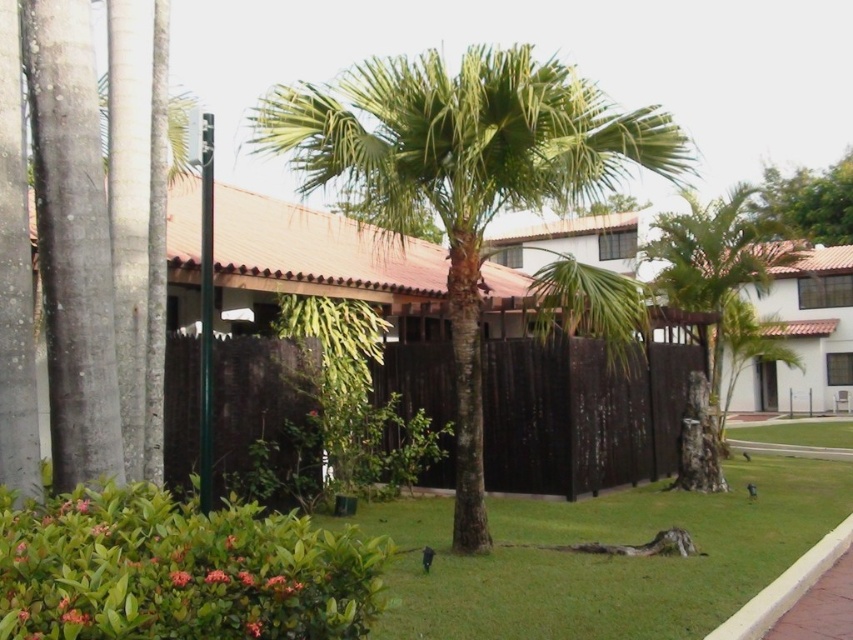
You are a gardener planning to plant a new flower bed between the brown wood fence at center and the green leafy tree at upper right. Which side of the fence should you place the flowers to ensure they are closer to the tree?

The flowers should be placed to the right side of the brown wood fence at center because the green leafy tree at upper right is located to the right of the fence.

You are a landscape architect designing a garden layout. You need to place a new statue between the green leafy palm tree at center and the green leafy tree at upper right. Which tree should the statue be closer to if you want it to be proportionally closer to the smaller tree?

The statue should be closer to the green leafy palm tree at center because it is the smaller tree between the two.

You are a gardener standing in the lawn. You need to water both the green leafy palm tree at center and the green leafy tree at upper right. Which tree should you water first if you want to start with the one closer to you?

You should water the green leafy palm tree at center first because it is closer to you than the green leafy tree at upper right.